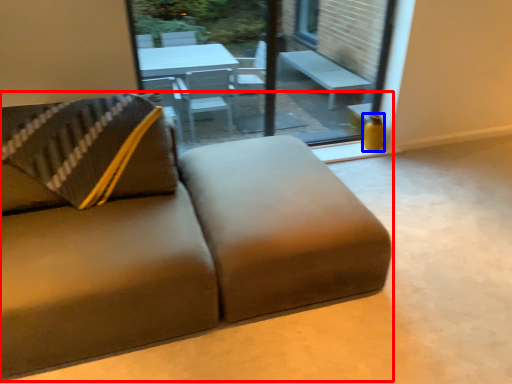
Question: Among these objects, which one is nearest to the camera, studio couch (highlighted by a red box) or vase (highlighted by a blue box)?

Choices:
 (A) studio couch
 (B) vase

Answer: (A)